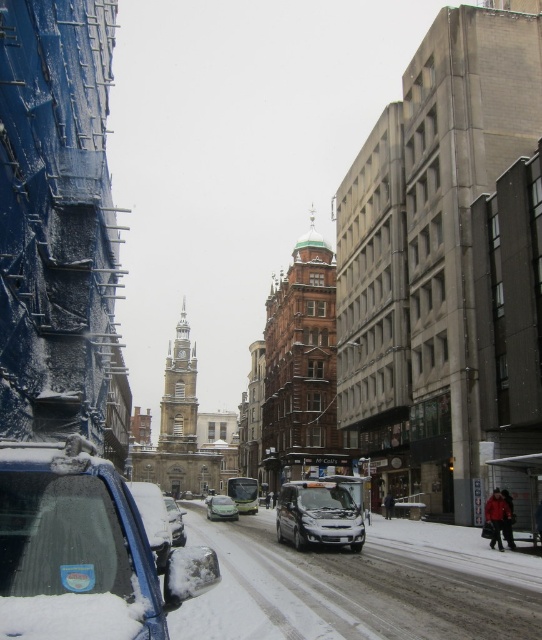
Can you confirm if shiny silver car at center is positioned to the left of green matte car at center?

No, shiny silver car at center is not to the left of green matte car at center.

Is shiny silver car at center positioned before green matte car at center?

No, it is behind green matte car at center.

This screenshot has width=542, height=640. I want to click on shiny silver car at center, so click(243, 493).

At what (x,y) coordinates should I click in order to perform the action: click on shiny silver car at center. Please return your answer as a coordinate pair (x, y). This screenshot has height=640, width=542. Looking at the image, I should click on (243, 493).

Is point (30, 572) closer to viewer compared to point (179, 532)?

Yes, point (30, 572) is closer to viewer.

Is point (149, 605) positioned behind point (178, 528)?

No, (149, 605) is in front of (178, 528).

This screenshot has width=542, height=640. What are the coordinates of `snow-covered blue car at lower left` in the screenshot? It's located at (82, 552).

Between point (165, 566) and point (235, 486), which one is positioned in front?

Point (165, 566) is more forward.

Does snow-covered blue car at lower left have a lesser width compared to shiny silver car at center?

No, snow-covered blue car at lower left is not thinner than shiny silver car at center.

Which is behind, point (169, 579) or point (251, 496)?

The point (251, 496) is more distant.

Find the location of a particular element. This screenshot has width=542, height=640. snow-covered blue car at lower left is located at coordinates (82, 552).